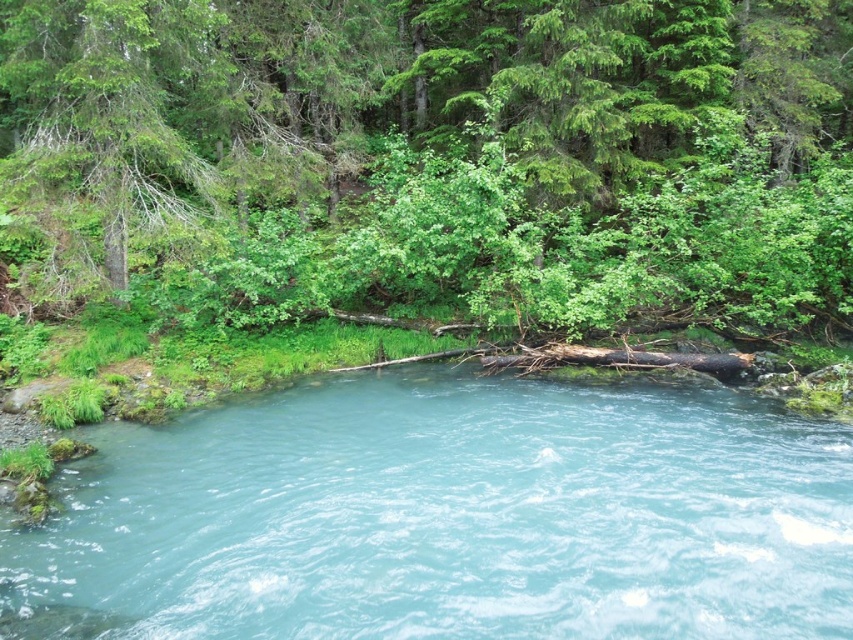
You are standing at the edge of the river and want to reach the green leafy tree at upper center. Which direction should you move to get closer to it without crossing the clear blue water at center?

You should move towards the green leafy tree at upper center by heading in the direction it is located, which is away from the clear blue water at center. Since the tree is further to the viewer than the water, moving towards the tree would mean going in the opposite direction of the water.

You are standing at the center of the river and want to reach the green leafy tree at upper center. In which direction should you move relative to the river?

The green leafy tree at upper center is located at point (439, 154), so you should move towards the upper center direction relative to the river.

You are a bird flying over the serene natural scene. You see the green leafy tree at upper center and the clear blue water at center. Which object is taller?

The green leafy tree at upper center is taller than the clear blue water at center.